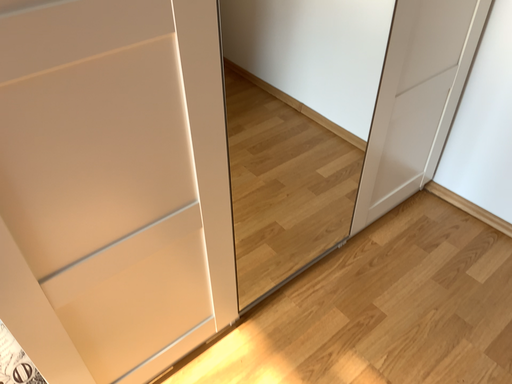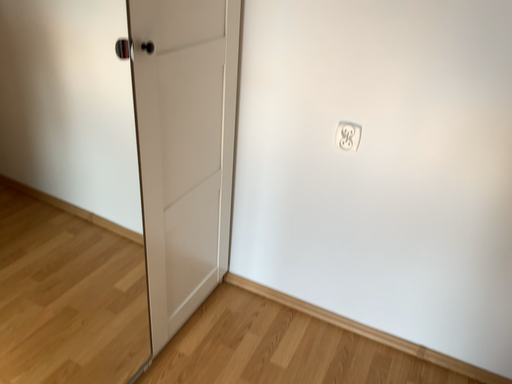
Question: Which way did the camera rotate in the video?

Choices:
 (A) rotated left
 (B) rotated right

Answer: (B)